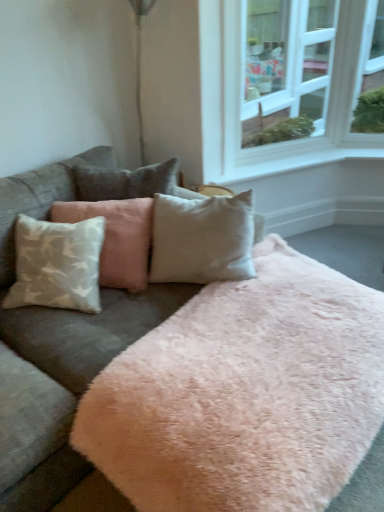
Find the location of `velvet gray couch at center`. velvet gray couch at center is located at coordinates coord(60,356).

The height and width of the screenshot is (512, 384). Describe the element at coordinates (291, 164) in the screenshot. I see `white smooth window sill at center` at that location.

Locate an element on the screen. The image size is (384, 512). velvet gray couch at center is located at coordinates (60, 356).

Can you confirm if velvet gray couch at center is taller than white glass window at upper right?

No.

Looking at this image, how many degrees apart are the facing directions of velvet gray couch at center and white glass window at upper right?

The facing directions of velvet gray couch at center and white glass window at upper right are 29.3 degrees apart.

Is velvet gray couch at center wider than white glass window at upper right?

Yes.

Is velvet gray couch at center completely or partially outside of white glass window at upper right?

Yes, velvet gray couch at center is not within white glass window at upper right.

Between white glass window at upper right and white textured pillow at left, which one has more height?

Standing taller between the two is white glass window at upper right.

Is white glass window at upper right smaller than white textured pillow at left?

No.

Is white textured pillow at left surrounded by white glass window at upper right?

Definitely not — white textured pillow at left is not inside white glass window at upper right.

Between point (234, 36) and point (125, 213), which one is positioned in front?

Positioned in front is point (125, 213).

Is white textured pillow at left positioned with its back to white glass window at upper right?

white textured pillow at left is not turned away from white glass window at upper right.

From a real-world perspective, relative to white glass window at upper right, is white textured pillow at left vertically above or below?

In terms of real-world spatial position, white textured pillow at left is below white glass window at upper right.

At what (x,y) coordinates should I click in order to perform the action: click on pillow in front of the white glass window at upper right. Please return your answer as a coordinate pair (x, y). Looking at the image, I should click on (117, 238).

Is white textured pillow at left closer to camera compared to white glass window at upper right?

Yes, white textured pillow at left is closer to the camera.

Locate an element on the screen. This screenshot has width=384, height=512. pillow on the left side of velvet gray couch at center is located at coordinates (117, 238).

Which is behind, point (66, 207) or point (52, 312)?

The point (66, 207) is farther.

Do you think white textured pillow at left is within velvet gray couch at center, or outside of it?

white textured pillow at left exists entirely within velvet gray couch at center.

Does white textured pillow at left appear on the left side of velvet gray couch at center?

Correct, you'll find white textured pillow at left to the left of velvet gray couch at center.

Can you confirm if velvet gray couch at center is thinner than white textured pillow at left?

In fact, velvet gray couch at center might be wider than white textured pillow at left.

What's the angular difference between velvet gray couch at center and white textured pillow at left's facing directions?

The facing directions of velvet gray couch at center and white textured pillow at left are 25.1 degrees apart.

From the image's perspective, which one is positioned higher, velvet gray couch at center or white textured pillow at left?

white textured pillow at left, from the image's perspective.

Is velvet gray couch at center turned away from white textured pillow at left?

Yes, white textured pillow at left is at the back of velvet gray couch at center.

From their relative heights in the image, would you say white textured pillow at left is taller or shorter than white smooth window sill at center?

In the image, white textured pillow at left appears to be taller than white smooth window sill at center.

From the picture: From a real-world perspective, is white textured pillow at left above or below white smooth window sill at center?

From a real-world perspective, white textured pillow at left is physically above white smooth window sill at center.

Considering their positions, is white textured pillow at left located in front of or behind white smooth window sill at center?

Visually, white textured pillow at left is located in front of white smooth window sill at center.

Between point (75, 221) and point (204, 170), which one is positioned behind?

Positioned behind is point (204, 170).

Between white glass window at upper right and velvet gray couch at center, which one has smaller size?

With smaller size is white glass window at upper right.

Looking at this image, from the image's perspective, is white glass window at upper right over velvet gray couch at center?

Indeed, from the image's perspective, white glass window at upper right is shown above velvet gray couch at center.

What's the angular difference between white glass window at upper right and velvet gray couch at center's facing directions?

They differ by 29.3 degrees in their facing directions.

Which of these two, white glass window at upper right or velvet gray couch at center, is wider?

Wider between the two is velvet gray couch at center.

Where is `window above the velvet gray couch at center (from the image's perspective)`? window above the velvet gray couch at center (from the image's perspective) is located at coordinates (300, 82).

I want to click on pillow below the white glass window at upper right (from the image's perspective), so click(117, 238).

Based on the photo, from the image, which object appears to be nearer to white glass window at upper right, velvet gray couch at center or white textured pillow at left?

white textured pillow at left is positioned closer to the anchor white glass window at upper right.

When comparing their distances from white smooth window sill at center, does white textured pillow at left or velvet gray couch at center seem further?

velvet gray couch at center.

Which object lies nearer to the anchor point white smooth window sill at center, white textured pillow at left or white glass window at upper right?

white glass window at upper right.

Estimate the real-world distances between objects in this image. Which object is further from white textured pillow at left, white glass window at upper right or white smooth window sill at center?

white glass window at upper right is further to white textured pillow at left.

Considering their positions, is white textured pillow at left positioned closer to velvet gray couch at center than white glass window at upper right?

Among the two, white textured pillow at left is located nearer to velvet gray couch at center.

When comparing their distances from velvet gray couch at center, does white textured pillow at left or white smooth window sill at center seem further?

Among the two, white smooth window sill at center is located further to velvet gray couch at center.

From the image, which object appears to be nearer to white smooth window sill at center, white glass window at upper right or velvet gray couch at center?

Among the two, white glass window at upper right is located nearer to white smooth window sill at center.

From the image, which object appears to be nearer to white smooth window sill at center, velvet gray couch at center or white textured pillow at left?

white textured pillow at left is closer to white smooth window sill at center.

Find the location of a particular element. The width and height of the screenshot is (384, 512). pillow between velvet gray couch at center and white smooth window sill at center from front to back is located at coordinates (117, 238).

This screenshot has height=512, width=384. I want to click on window sill situated between white textured pillow at left and white glass window at upper right from left to right, so click(291, 164).

This screenshot has width=384, height=512. What are the coordinates of `pillow located between velvet gray couch at center and white glass window at upper right in the depth direction` in the screenshot? It's located at (117, 238).

Identify the location of window located between velvet gray couch at center and white smooth window sill at center in the depth direction. (300, 82).